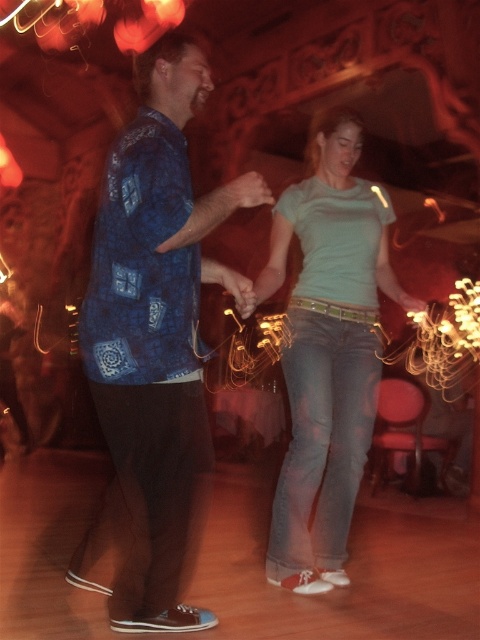
In the scene shown: You are a photographer trying to capture the dancers in the scene. The blue printed shirt at center and the light blue denim jeans at center are part of the same person. Which direction should you pan your camera to focus on the jeans?

The blue printed shirt at center is to the left of light blue denim jeans at center, so you should pan your camera to the right to focus on the jeans.

What are the coordinates of the blue printed shirt at center?

The blue printed shirt at center is located at point (153, 348).